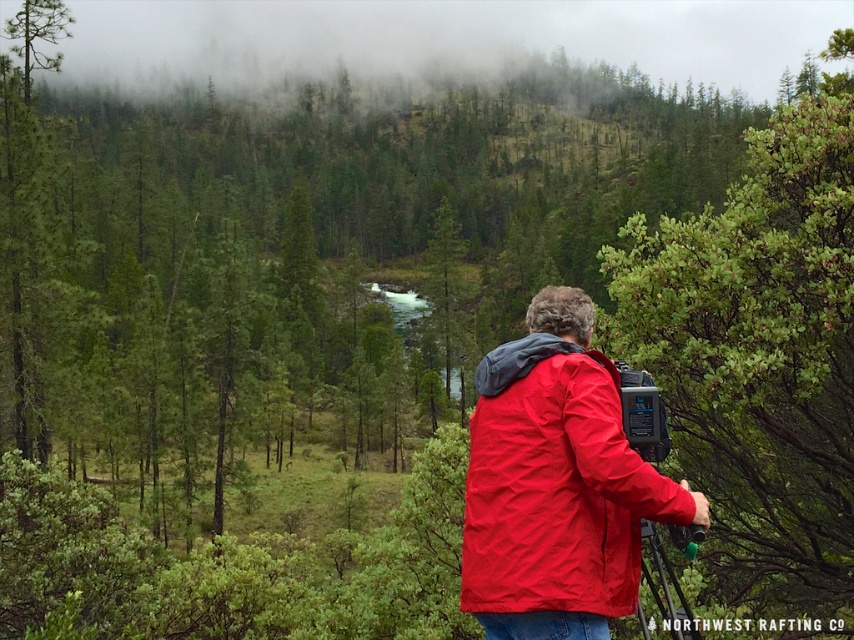
Question: Is green leafy shrub at right smaller than red matte jacket at center?

Choices:
 (A) yes
 (B) no

Answer: (B)

Question: Does green leafy shrub at right have a greater width compared to red matte jacket at center?

Choices:
 (A) yes
 (B) no

Answer: (A)

Question: Which of the following is the closest to the observer?

Choices:
 (A) tap(651, 580)
 (B) tap(483, 435)

Answer: (B)

Question: Which point is closer to the camera?

Choices:
 (A) (553, 570)
 (B) (664, 595)
 (C) (668, 228)

Answer: (A)

Question: Does red matte jacket at center have a larger size compared to metallic tripod at center?

Choices:
 (A) no
 (B) yes

Answer: (B)

Question: Which of the following is the farthest from the observer?

Choices:
 (A) red matte jacket at center
 (B) green leafy shrub at right

Answer: (B)